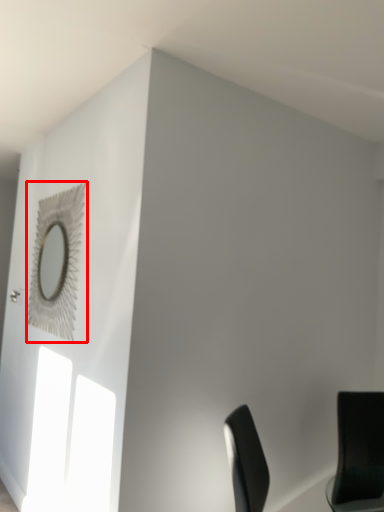
Question: Observing the image, what is the correct spatial positioning of mirror (annotated by the red box) in reference to chair?

Choices:
 (A) right
 (B) left

Answer: (B)